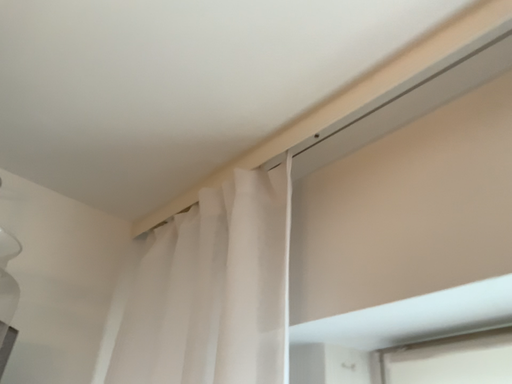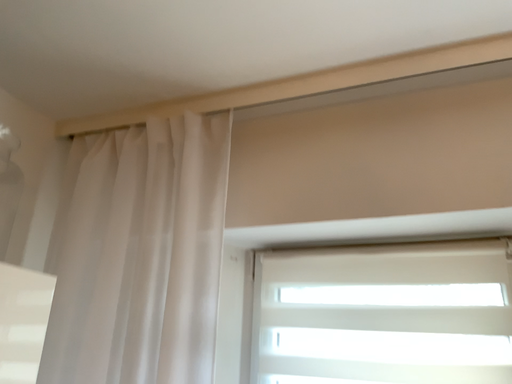
Question: Which way did the camera rotate in the video?

Choices:
 (A) rotated upward
 (B) rotated downward

Answer: (B)